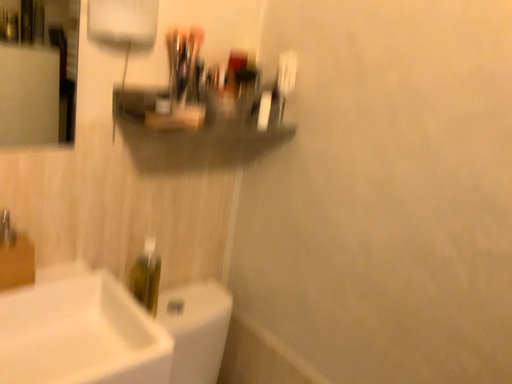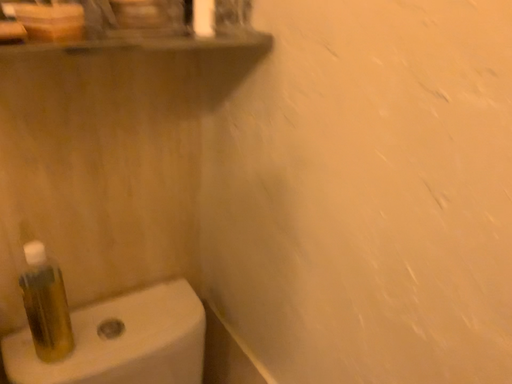
Question: How did the camera likely rotate when shooting the video?

Choices:
 (A) rotated downward
 (B) rotated upward

Answer: (A)